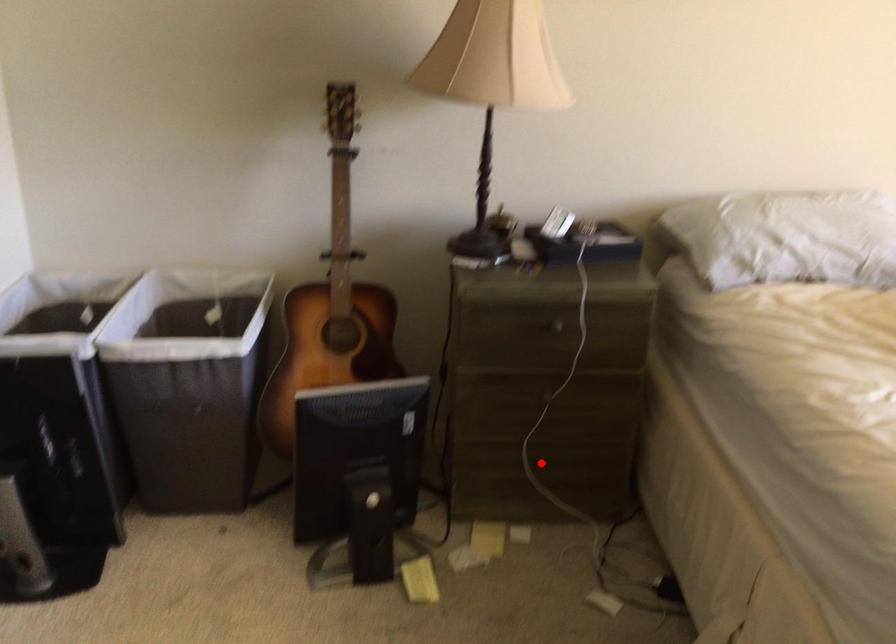
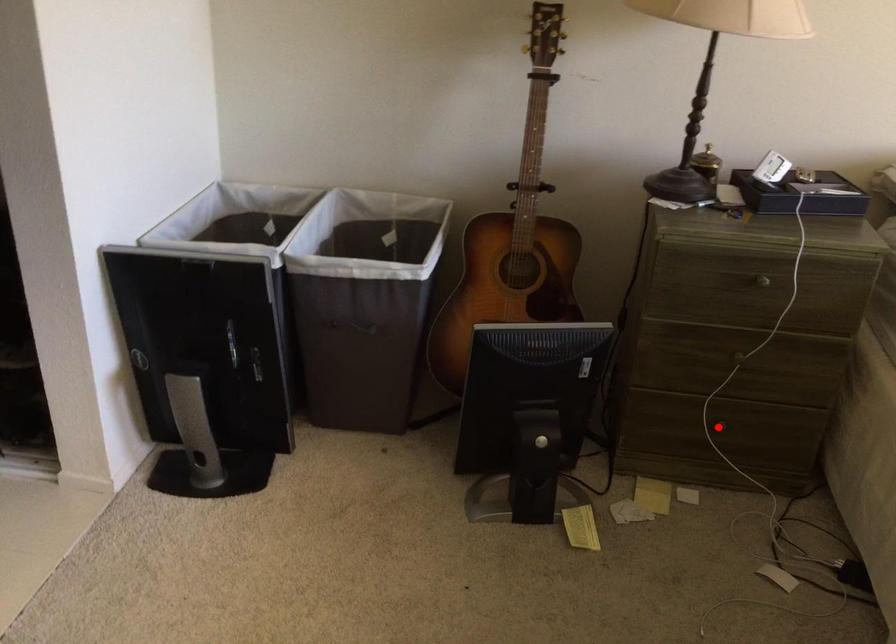
I am providing you with two images of the same scene from different viewpoints. A red point is marked on the first image and another point is marked on the second image. Does the point marked in image1 correspond to the same location as the one in image2?

Yes